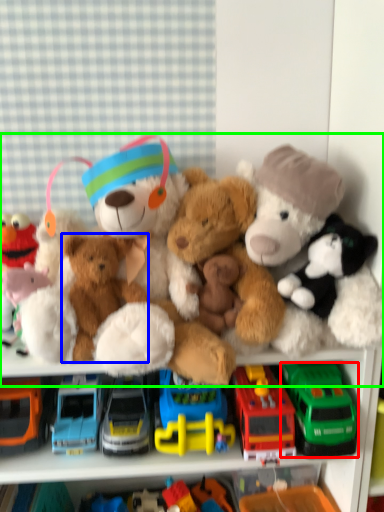
Question: Which is nearer to the truck (highlighted by a red box)? toy (highlighted by a blue box) or teddy bear (highlighted by a green box).

Choices:
 (A) toy
 (B) teddy bear

Answer: (B)